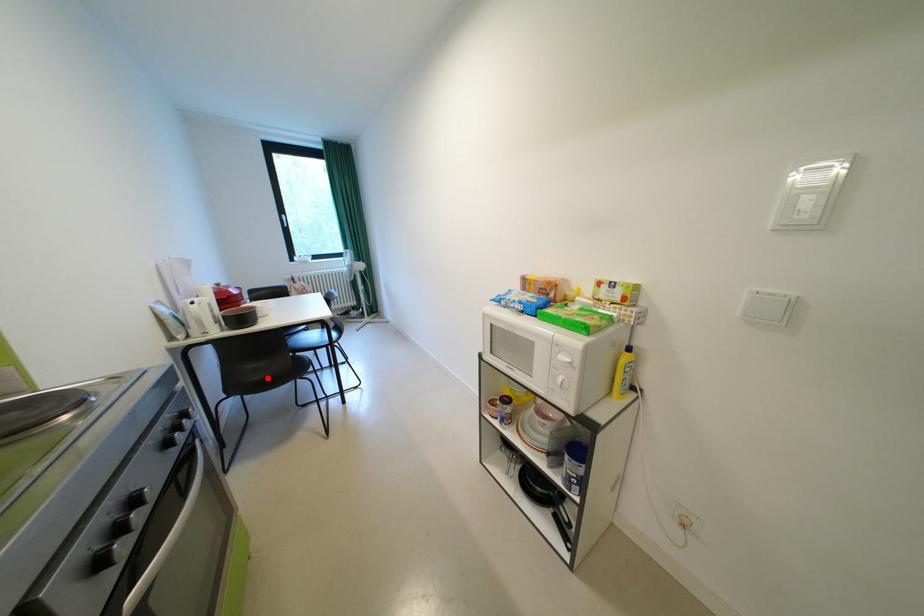
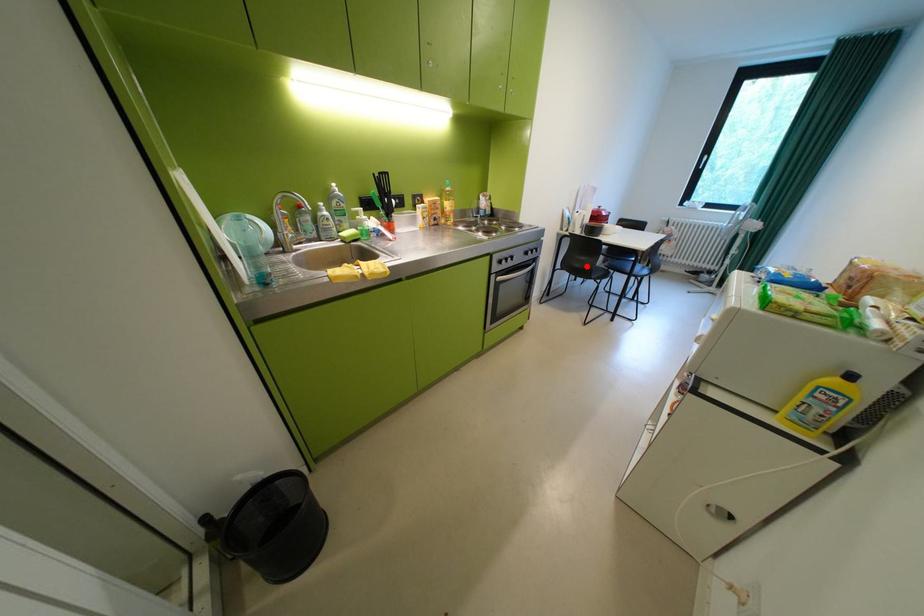
I am providing you with two images of the same scene from different viewpoints. A red point is marked on the first image and another point is marked on the second image. Do the highlighted points in image1 and image2 indicate the same real-world spot?

Yes